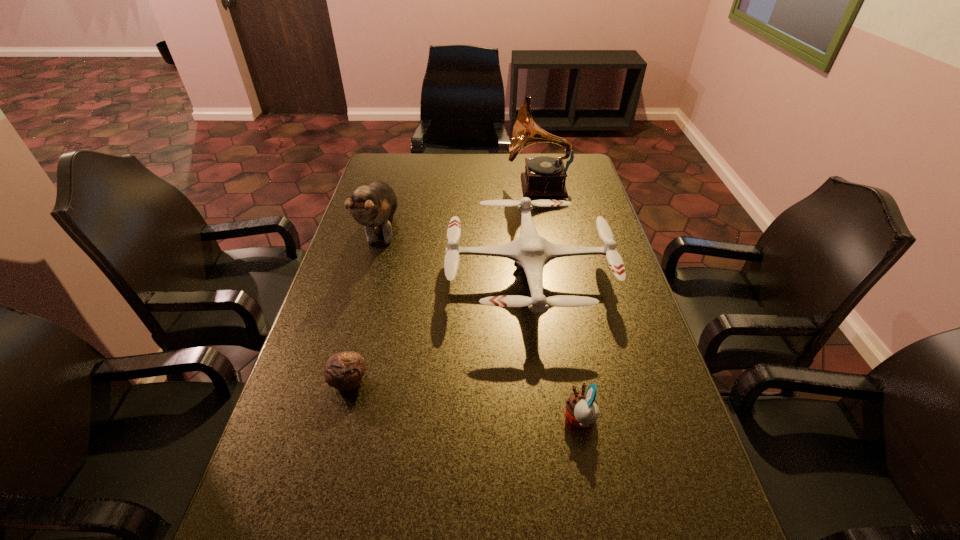
At what (x,y) coordinates should I click in order to perform the action: click on the tallest object. Please return your answer as a coordinate pair (x, y). The width and height of the screenshot is (960, 540). Looking at the image, I should click on (544, 176).

The width and height of the screenshot is (960, 540). I want to click on cat, so click(x=375, y=204).

This screenshot has height=540, width=960. In order to click on drone in this screenshot , I will do tap(530, 252).

Locate an element on the screen. the nearer muffin is located at coordinates (582, 410).

The image size is (960, 540). I want to click on the nearest object, so click(582, 410).

I want to click on the shortest object, so click(x=344, y=371).

Locate an element on the screen. the farther muffin is located at coordinates (344, 371).

Identify the location of vacant space located 0.130m on the horn of the tallest object. (473, 186).

This screenshot has width=960, height=540. Identify the location of vacant space located 0.320m on the horn of the tallest object. (423, 186).

You are a GUI agent. You are given a task and a screenshot of the screen. Output one action in this format:
    pyautogui.click(x=<x>, y=<y>)
    Task: Click on the free space located 0.280m on the horn of the tallest object
    
    Given the screenshot: What is the action you would take?
    pyautogui.click(x=434, y=186)